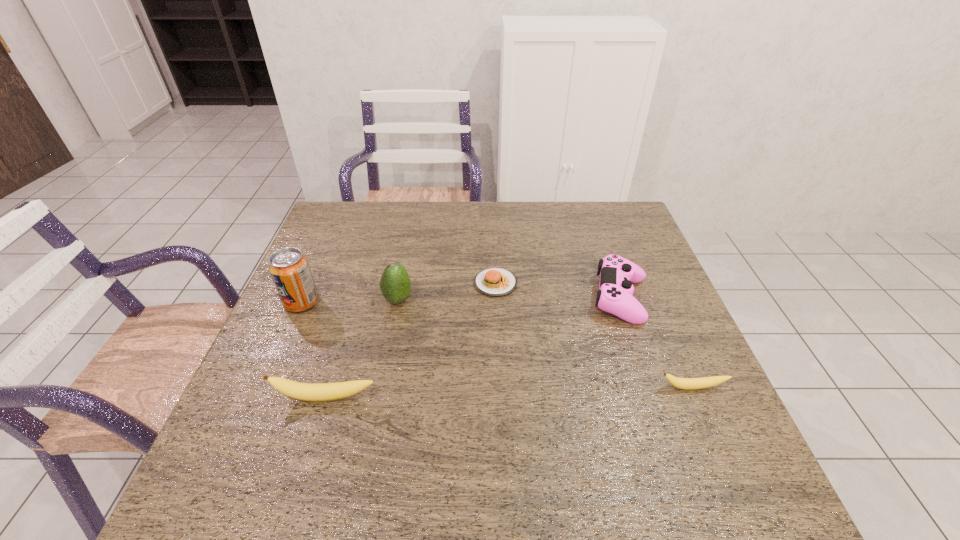
Find the location of a particular element. vacant space at the right edge is located at coordinates pos(646,290).

The width and height of the screenshot is (960, 540). Find the location of `free space at the far left corner of the desktop`. free space at the far left corner of the desktop is located at coordinates (343, 211).

This screenshot has width=960, height=540. I want to click on blank space at the far right corner of the desktop, so click(x=595, y=202).

Identify the location of free spot at the near right corner of the desktop. (x=739, y=438).

This screenshot has height=540, width=960. Find the location of `free space between the right banana and the soda can`. free space between the right banana and the soda can is located at coordinates 497,345.

Where is `vacant region between the soda can and the avocado`? The image size is (960, 540). vacant region between the soda can and the avocado is located at coordinates (349, 301).

Identify the location of free spot between the avocado and the soda can. The width and height of the screenshot is (960, 540). (349, 301).

This screenshot has width=960, height=540. Find the location of `free spot between the shorter banana and the tallest object`. free spot between the shorter banana and the tallest object is located at coordinates (497, 345).

Where is `vacant space in between the control and the taller banana`? This screenshot has height=540, width=960. vacant space in between the control and the taller banana is located at coordinates (473, 348).

This screenshot has height=540, width=960. I want to click on free space between the taller banana and the right banana, so [509, 393].